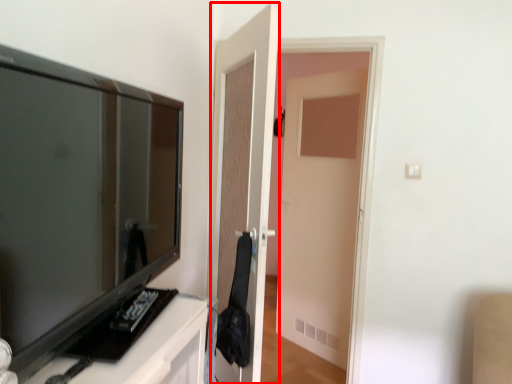
Question: Observing the image, what is the correct spatial positioning of door (annotated by the red box) in reference to television?

Choices:
 (A) left
 (B) right

Answer: (B)